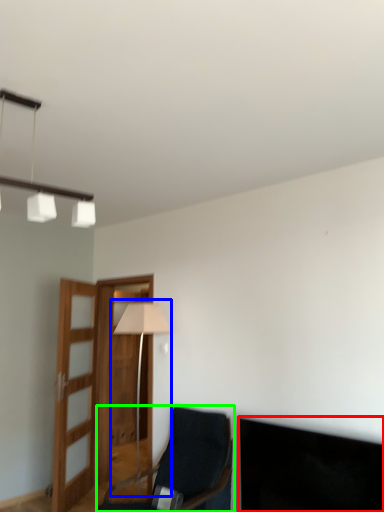
Question: Estimate the real-world distances between objects in this image. Which object is closer to dark (highlighted by a red box), table lamp (highlighted by a blue box) or chair (highlighted by a green box)?

Choices:
 (A) table lamp
 (B) chair

Answer: (B)